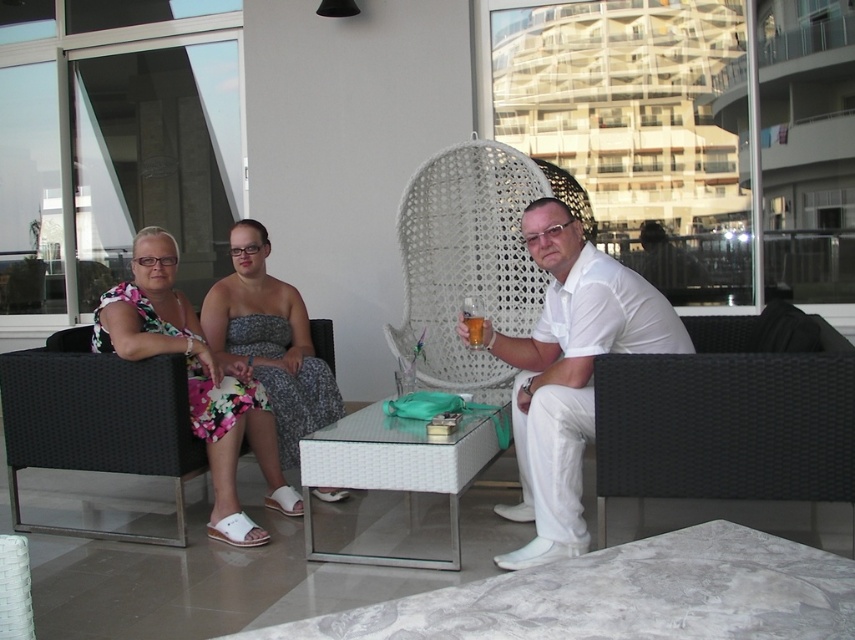
In the scene shown: Between white matte shirt at center and translucent glass cup at center, which one is positioned higher?

Positioned higher is translucent glass cup at center.

Consider the image. Is white matte shirt at center thinner than translucent glass cup at center?

No, white matte shirt at center is not thinner than translucent glass cup at center.

Is point (565, 400) behind point (470, 324)?

No, (565, 400) is in front of (470, 324).

The width and height of the screenshot is (855, 640). In order to click on white matte shirt at center in this screenshot , I will do `click(569, 372)`.

What do you see at coordinates (270, 340) in the screenshot?
I see `floral fabric dress at center` at bounding box center [270, 340].

Can you confirm if floral fabric dress at center is positioned above translucent glass cup at center?

Actually, floral fabric dress at center is below translucent glass cup at center.

Who is more distant from viewer, (240, 253) or (475, 342)?

The point (240, 253) is more distant.

Find the location of a particular element. The height and width of the screenshot is (640, 855). floral fabric dress at center is located at coordinates (270, 340).

Which is above, white matte shirt at center or transparent glass table at center?

Positioned higher is white matte shirt at center.

Who is taller, white matte shirt at center or transparent glass table at center?

With more height is white matte shirt at center.

Image resolution: width=855 pixels, height=640 pixels. What do you see at coordinates (569, 372) in the screenshot? I see `white matte shirt at center` at bounding box center [569, 372].

Identify the location of white matte shirt at center. This screenshot has width=855, height=640. (569, 372).